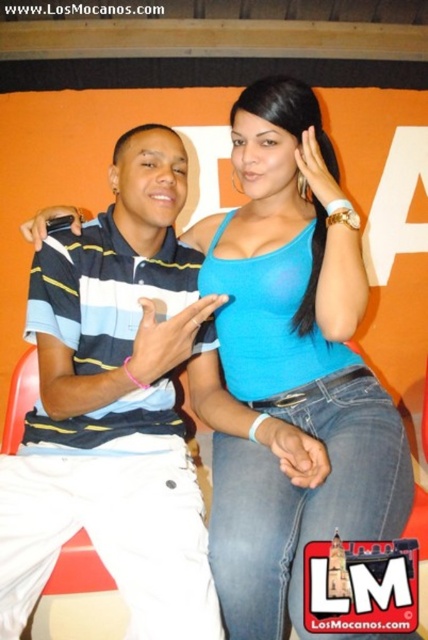
Question: Which object appears closest to the camera in this image?

Choices:
 (A) striped cotton polo shirt at center
 (B) blue matte tank top at center

Answer: (B)

Question: Is striped cotton polo shirt at center in front of blue matte tank top at center?

Choices:
 (A) yes
 (B) no

Answer: (B)

Question: Which object is closer to the camera taking this photo?

Choices:
 (A) striped cotton polo shirt at center
 (B) blue matte tank top at center

Answer: (B)

Question: Does striped cotton polo shirt at center have a lesser width compared to blue matte tank top at center?

Choices:
 (A) yes
 (B) no

Answer: (A)

Question: Is the position of striped cotton polo shirt at center more distant than that of blue matte tank top at center?

Choices:
 (A) no
 (B) yes

Answer: (B)